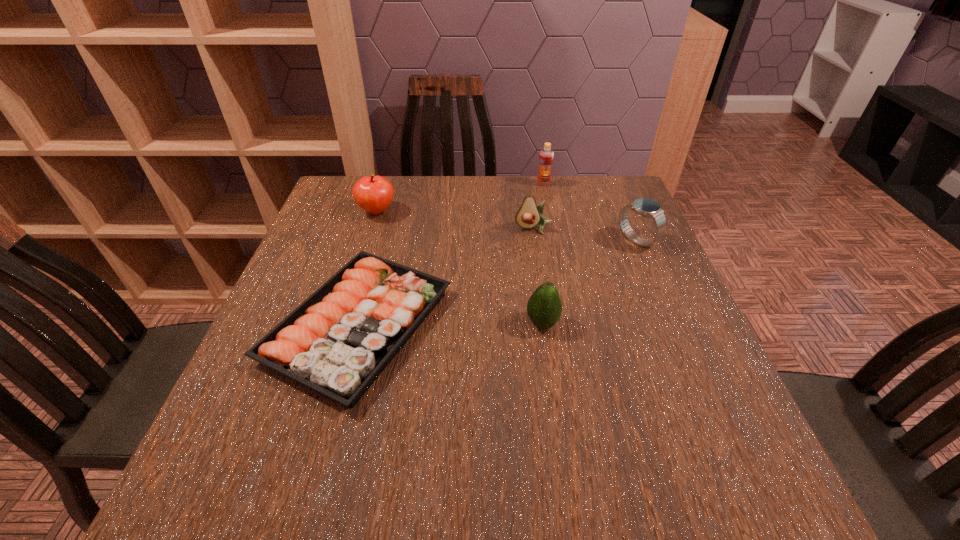
In order to click on free spot at the right edge of the desktop in this screenshot , I will do `click(688, 312)`.

Where is `vacant space at the far left corner of the desktop`? Image resolution: width=960 pixels, height=540 pixels. vacant space at the far left corner of the desktop is located at coordinates (350, 214).

In the image, there is a desktop. Where is `free region at the far right corner`? free region at the far right corner is located at coordinates (577, 187).

Identify the location of vacant space at the near right corner. (685, 471).

Where is `free space between the shortest object and the farther avocado`? Image resolution: width=960 pixels, height=540 pixels. free space between the shortest object and the farther avocado is located at coordinates (446, 277).

This screenshot has width=960, height=540. In order to click on free space between the farther avocado and the watch in this screenshot , I will do `click(586, 234)`.

Where is `free spot between the nearer avocado and the rightmost object`? This screenshot has height=540, width=960. free spot between the nearer avocado and the rightmost object is located at coordinates pyautogui.click(x=589, y=282).

I want to click on free area in between the nearer avocado and the orange juice, so click(x=543, y=253).

Where is `unoccupied position between the nearer avocado and the farthest object`? This screenshot has height=540, width=960. unoccupied position between the nearer avocado and the farthest object is located at coordinates (543, 253).

In order to click on free space between the rightmost object and the shortest object in this screenshot , I will do `click(497, 283)`.